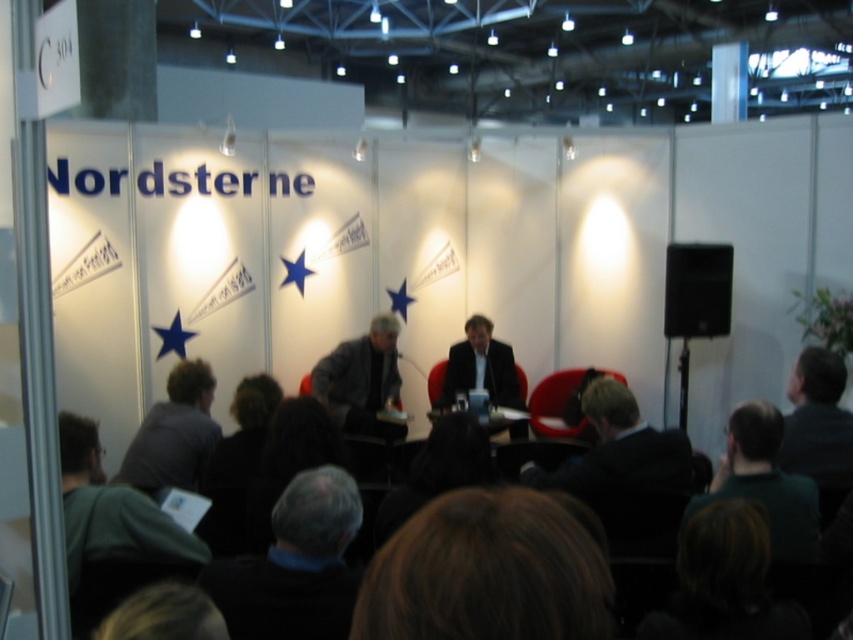
Does brown hair at center appear on the right side of dark green shirt at lower right?

Incorrect, brown hair at center is not on the right side of dark green shirt at lower right.

Is brown hair at center shorter than dark green shirt at lower right?

Indeed, brown hair at center has a lesser height compared to dark green shirt at lower right.

Does point (578, 589) come closer to viewer compared to point (811, 516)?

Yes, it is in front of point (811, 516).

You are a GUI agent. You are given a task and a screenshot of the screen. Output one action in this format:
    pyautogui.click(x=<x>, y=<y>)
    Task: Click on the brown hair at center
    This screenshot has width=853, height=640.
    Given the screenshot: What is the action you would take?
    pyautogui.click(x=486, y=572)

Can you confirm if dark gray sweater at lower center is thinner than dark gray shirt at lower left?

Yes.

Is dark gray sweater at lower center below dark gray shirt at lower left?

No, dark gray sweater at lower center is not below dark gray shirt at lower left.

Does point (344, 502) come in front of point (157, 435)?

Yes, point (344, 502) is in front of point (157, 435).

Identify the location of dark gray sweater at lower center. (294, 564).

Can you confirm if dark gray sweater at lower center is bigger than dark green shirt at lower right?

No, dark gray sweater at lower center is not bigger than dark green shirt at lower right.

Who is more forward, (270, 612) or (795, 538)?

Positioned in front is point (270, 612).

Which is in front, point (286, 540) or point (724, 468)?

Point (286, 540) is in front.

Image resolution: width=853 pixels, height=640 pixels. I want to click on dark gray sweater at lower center, so click(x=294, y=564).